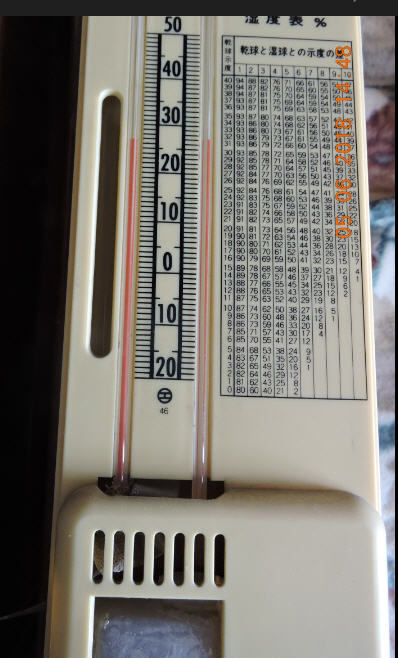
Where is `thermometer`? The height and width of the screenshot is (658, 398). thermometer is located at coordinates (133, 195), (206, 389).